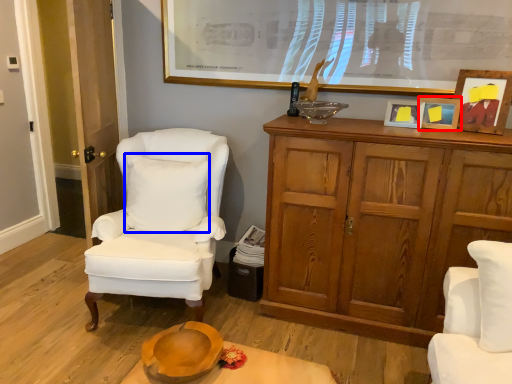
Question: Which of the following is the closest to the observer, picture frame (highlighted by a red box) or pillow (highlighted by a blue box)?

Choices:
 (A) picture frame
 (B) pillow

Answer: (A)